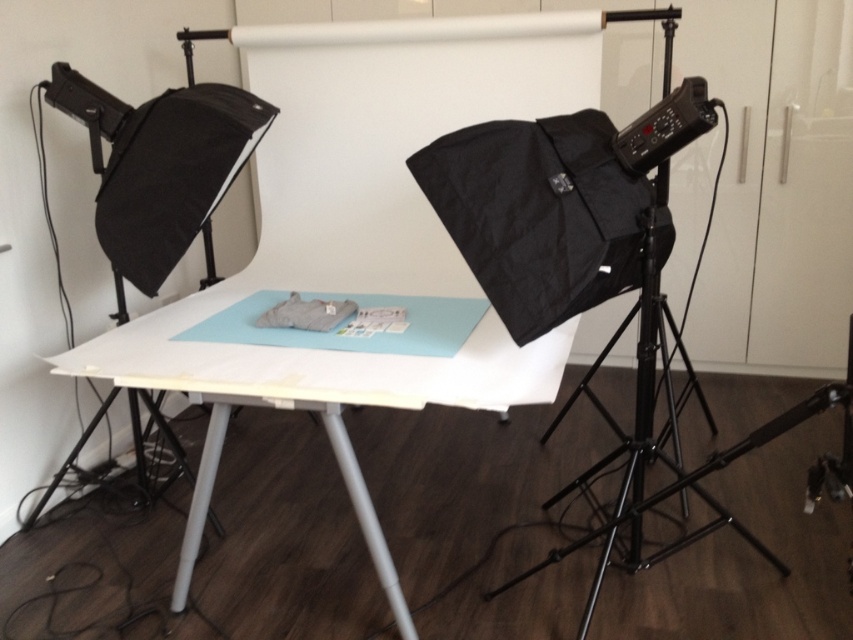
Is white matte table at center positioned before black plastic light at upper right?

Yes, white matte table at center is in front of black plastic light at upper right.

Does point (537, 342) lie behind point (677, 122)?

Yes.

Is point (196, 486) positioned in front of point (692, 96)?

No.

Locate an element on the screen. The width and height of the screenshot is (853, 640). white matte table at center is located at coordinates (316, 385).

Is white matte table at center wider than black metal tripod at right?

Indeed, white matte table at center has a greater width compared to black metal tripod at right.

Does white matte table at center lie in front of black metal tripod at right?

Yes, white matte table at center is in front of black metal tripod at right.

Does point (344, 369) lie in front of point (640, 369)?

That is True.

Identify the location of white matte table at center. (316, 385).

Does black metal tripod at right appear on the left side of black plastic light at upper right?

No, black metal tripod at right is not to the left of black plastic light at upper right.

Is point (635, 394) less distant than point (648, 145)?

No, (635, 394) is further to viewer.

Locate an element on the screen. This screenshot has height=640, width=853. black metal tripod at right is located at coordinates (645, 433).